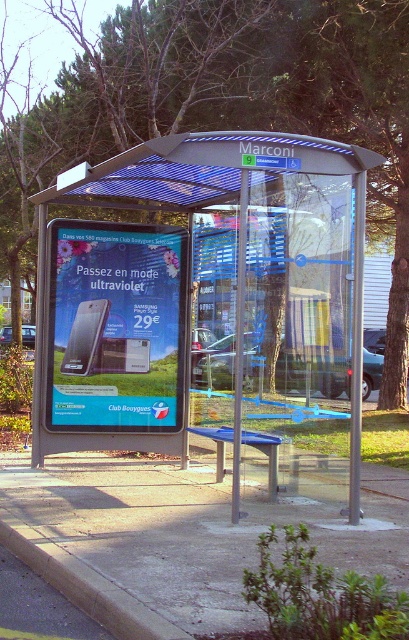
Does transparent glass bus stop at center have a smaller size compared to transparent plastic canopy at center?

Actually, transparent glass bus stop at center might be larger than transparent plastic canopy at center.

Which is behind, point (361, 205) or point (296, 150)?

Point (361, 205)

Is point (157, 179) positioned behind point (193, 145)?

Yes, it is.

You are a GUI agent. You are given a task and a screenshot of the screen. Output one action in this format:
    pyautogui.click(x=<x>, y=<y>)
    Task: Click on the transparent glass bus stop at center
    The width and height of the screenshot is (409, 640).
    Given the screenshot: What is the action you would take?
    pyautogui.click(x=220, y=202)

Is concrete at center shorter than matte black phone at center?

Correct, concrete at center is not as tall as matte black phone at center.

Which is in front, point (139, 502) or point (150, 416)?

Point (139, 502) is in front.

Where is `concrete at center`? The width and height of the screenshot is (409, 640). concrete at center is located at coordinates [x=186, y=532].

Looking at this image, can you confirm if matte black phone at center is wider than yellow painted concrete curb at lower left?

No, matte black phone at center is not wider than yellow painted concrete curb at lower left.

Does point (173, 259) lie in front of point (136, 628)?

No, it is not.

The width and height of the screenshot is (409, 640). What are the coordinates of `matte black phone at center` in the screenshot? It's located at (116, 326).